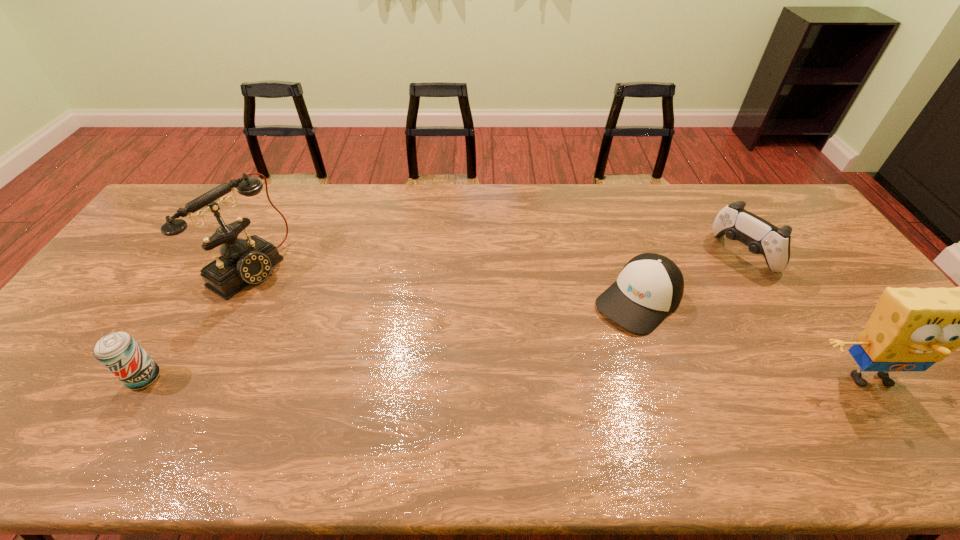
You are a GUI agent. You are given a task and a screenshot of the screen. Output one action in this format:
    pyautogui.click(x=<x>, y=<y>)
    Task: Click on the vacant area that lies between the control and the beer can
    
    Given the screenshot: What is the action you would take?
    pyautogui.click(x=443, y=316)

Identify the location of free space between the beer can and the sponge. (507, 378).

At what (x,y) coordinates should I click in order to perform the action: click on free space that is in between the cap and the beer can. Please return your answer as a coordinate pair (x, y). This screenshot has width=960, height=540. Looking at the image, I should click on (392, 339).

Where is `object that is the third closest to the control`? Image resolution: width=960 pixels, height=540 pixels. object that is the third closest to the control is located at coordinates (242, 262).

Identify which object is the fourth closest to the beer can. Please provide its 2D coordinates. Your answer should be formatted as a tuple, i.e. [(x, y)], where the tuple contains the x and y coordinates of a point satisfying the conditions above.

[(911, 329)]

You are a GUI agent. You are given a task and a screenshot of the screen. Output one action in this format:
    pyautogui.click(x=<x>, y=<y>)
    Task: Click on the free spot that satisfies the following two spatial constraints: 1. on the back side of the beer can; 2. on the left side of the telephone
    
    Given the screenshot: What is the action you would take?
    pos(211,268)